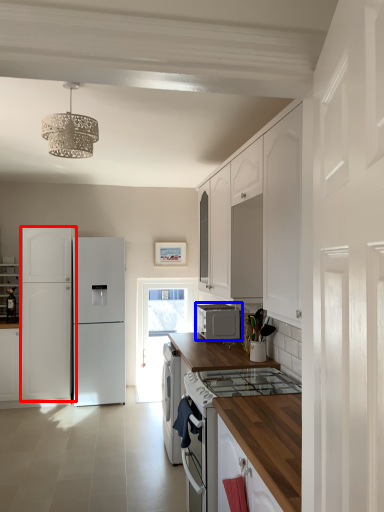
Question: Which point is further to the camera, cabinetry (highlighted by a red box) or home appliance (highlighted by a blue box)?

Choices:
 (A) cabinetry
 (B) home appliance

Answer: (A)